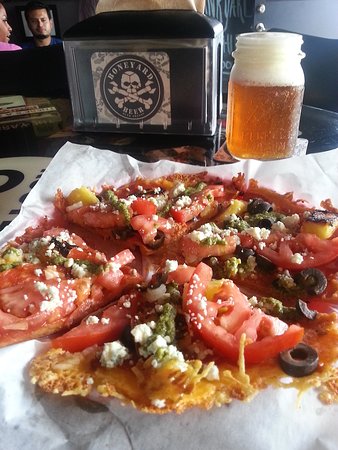
Locate an element on the screen. The width and height of the screenshot is (338, 450). mason jar is located at coordinates (267, 61).